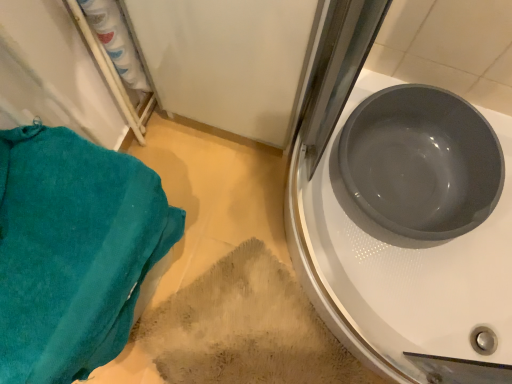
Question: In the image, is teal terry cloth towel at lower left on the left side or the right side of matte gray basin at right?

Choices:
 (A) right
 (B) left

Answer: (B)

Question: Would you say teal terry cloth towel at lower left is inside or outside matte gray basin at right?

Choices:
 (A) inside
 (B) outside

Answer: (B)

Question: Estimate the real-world distances between objects in this image. Which object is closer to the beige textured rug at lower center?

Choices:
 (A) teal terry cloth towel at lower left
 (B) matte gray basin at upper right
 (C) matte gray basin at right

Answer: (B)

Question: Which is nearer to the beige textured rug at lower center?

Choices:
 (A) teal terry cloth towel at lower left
 (B) matte gray basin at upper right
 (C) matte gray basin at right

Answer: (B)